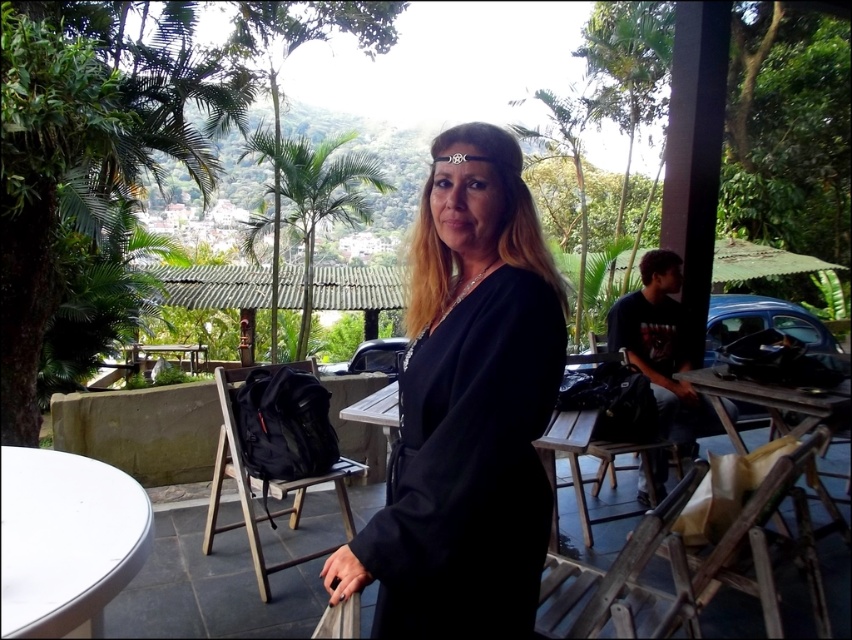
You are a photographer trying to capture the woman in the black matte dress at center. If you want to focus on her dress, where should you aim your camera? Please provide coordinates in the format of x,y between 0 and 1.

The black matte dress at center is located at coordinates (467, 410), so you should aim your camera at that point to focus on her dress.